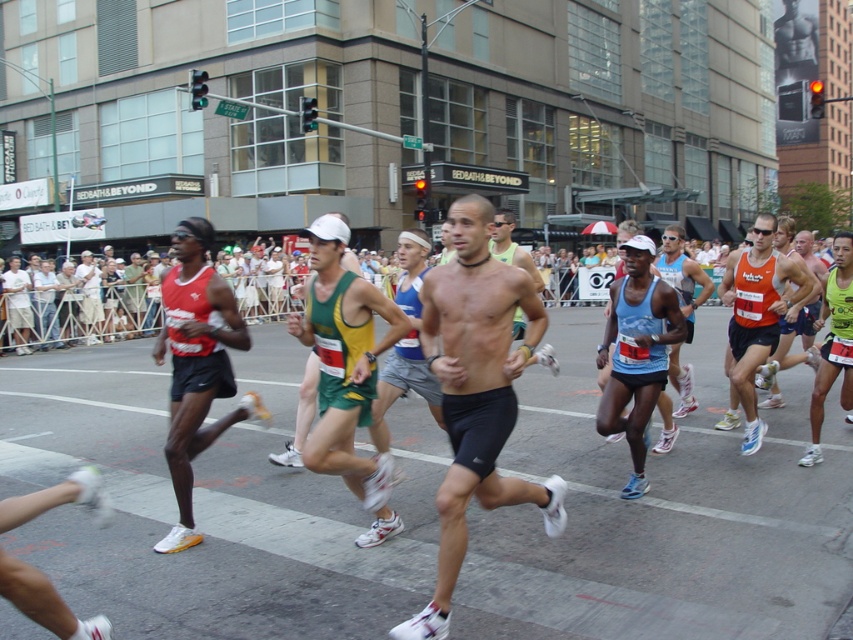
Question: Which point is farther to the camera?

Choices:
 (A) shiny black shorts at center
 (B) matte red tank top at left
 (C) orange mesh tank top at center

Answer: (C)

Question: Is shiny black shorts at center below matte red tank top at left?

Choices:
 (A) no
 (B) yes

Answer: (B)

Question: Does shiny black shorts at center have a smaller size compared to matte red tank top at left?

Choices:
 (A) yes
 (B) no

Answer: (B)

Question: Based on their relative distances, which object is nearer to the shiny black shorts at center?

Choices:
 (A) reddish-brown tank top at left
 (B) orange mesh tank top at center

Answer: (B)

Question: Among these objects, which one is nearest to the camera?

Choices:
 (A) orange mesh tank top at center
 (B) matte red tank top at left
 (C) reddish-brown tank top at left
 (D) shiny black shorts at center

Answer: (D)

Question: In this image, where is shiny black shorts at center located relative to reddish-brown tank top at left?

Choices:
 (A) left
 (B) right

Answer: (B)